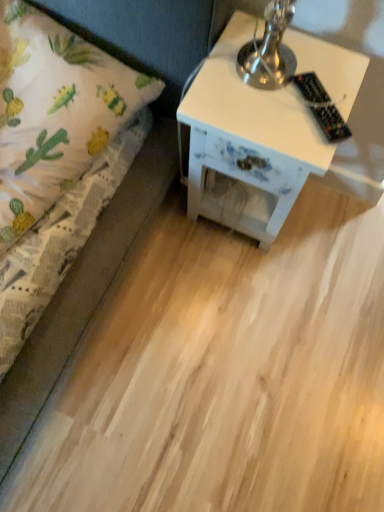
Question: Considering the positions of black plastic remote control at upper right and white painted wood nightstand at right in the image, is black plastic remote control at upper right bigger or smaller than white painted wood nightstand at right?

Choices:
 (A) small
 (B) big

Answer: (A)

Question: Considering the positions of black plastic remote control at upper right and white painted wood nightstand at right in the image, is black plastic remote control at upper right taller or shorter than white painted wood nightstand at right?

Choices:
 (A) short
 (B) tall

Answer: (A)

Question: Which of these objects is positioned farthest from the white painted wood nightstand at right?

Choices:
 (A) white fabric bed at left
 (B) black plastic remote control at upper right

Answer: (A)

Question: Which object is the farthest from the white fabric bed at left?

Choices:
 (A) black plastic remote control at upper right
 (B) white painted wood nightstand at right

Answer: (A)